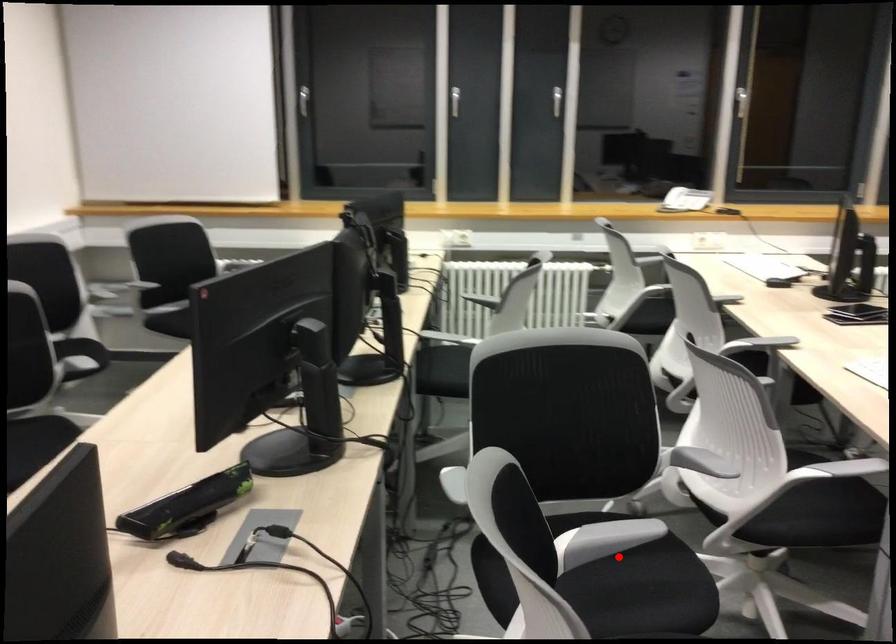
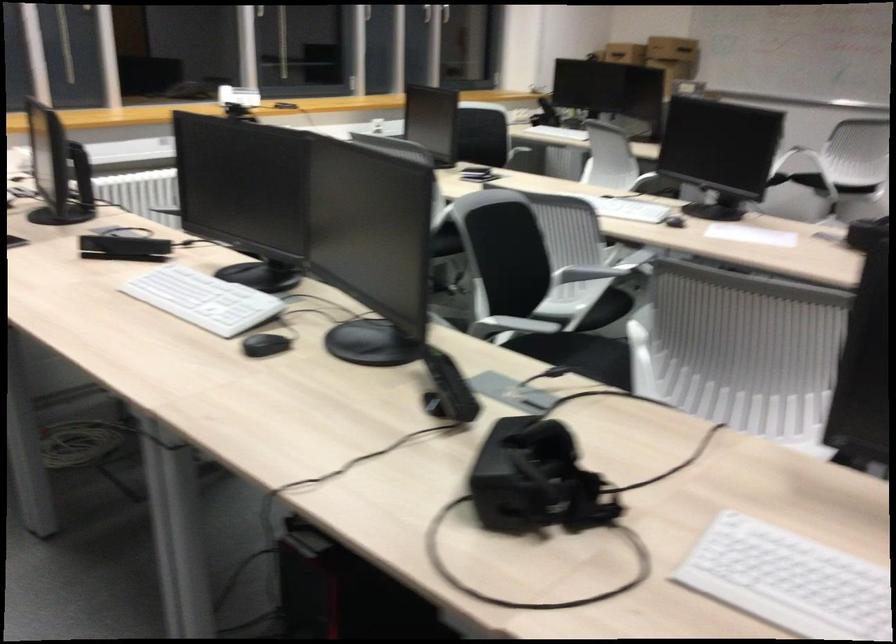
Locate, in the second image, the point that corresponds to the highlighted location in the first image.

(579, 355)